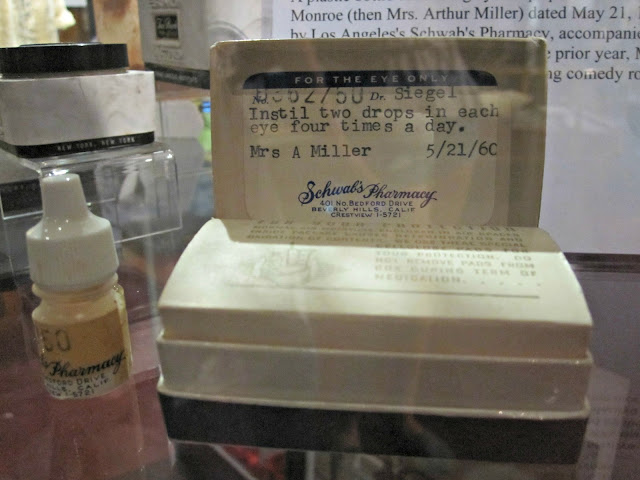
Identify the location of glass shelf. (612, 293), (609, 404), (408, 465), (196, 459), (42, 437), (136, 282).